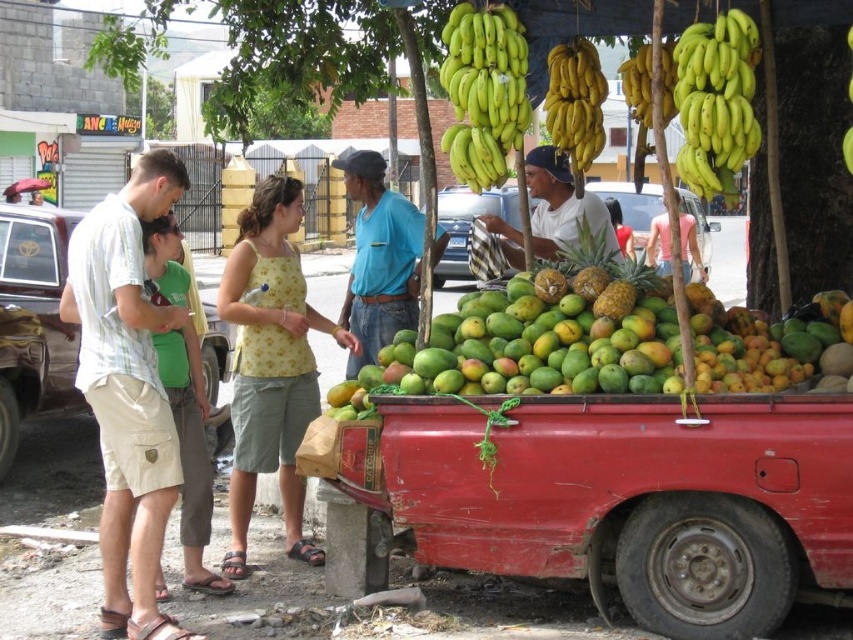
Is point (482, 326) positioned after point (584, 97)?

No.

The width and height of the screenshot is (853, 640). Identify the location of green matte mangoes at center. (531, 346).

Between green matte bananas at upper right and yellow smooth bananas at upper center, which one is positioned higher?

yellow smooth bananas at upper center is above.

Which is behind, point (697, 72) or point (627, 74)?

Point (627, 74)

Where is `green matte bananas at upper right`? Image resolution: width=853 pixels, height=640 pixels. green matte bananas at upper right is located at coordinates (717, 100).

Measure the distance between blue cotton shirt at center and yellow smooth bananas at upper center.

They are 7.76 feet apart.

Between point (367, 150) and point (650, 113), which one is positioned behind?

Positioned behind is point (367, 150).

The width and height of the screenshot is (853, 640). Find the location of `blue cotton shirt at center`. blue cotton shirt at center is located at coordinates (379, 259).